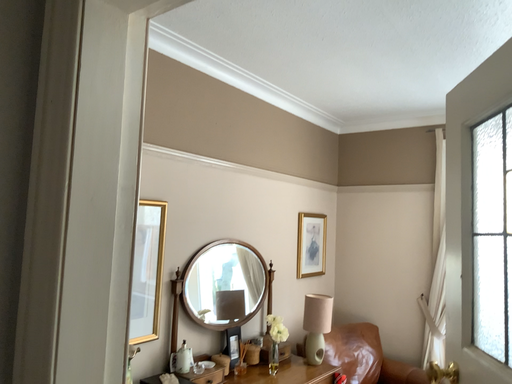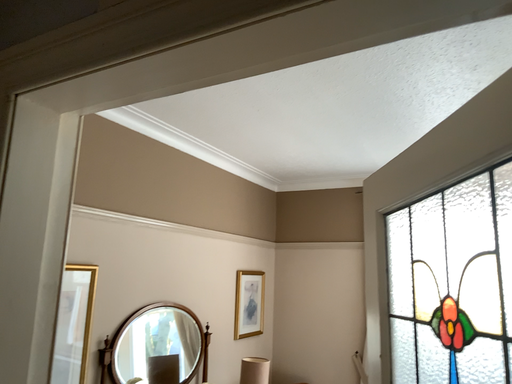
Question: How did the camera likely rotate when shooting the video?

Choices:
 (A) rotated right
 (B) rotated left

Answer: (A)